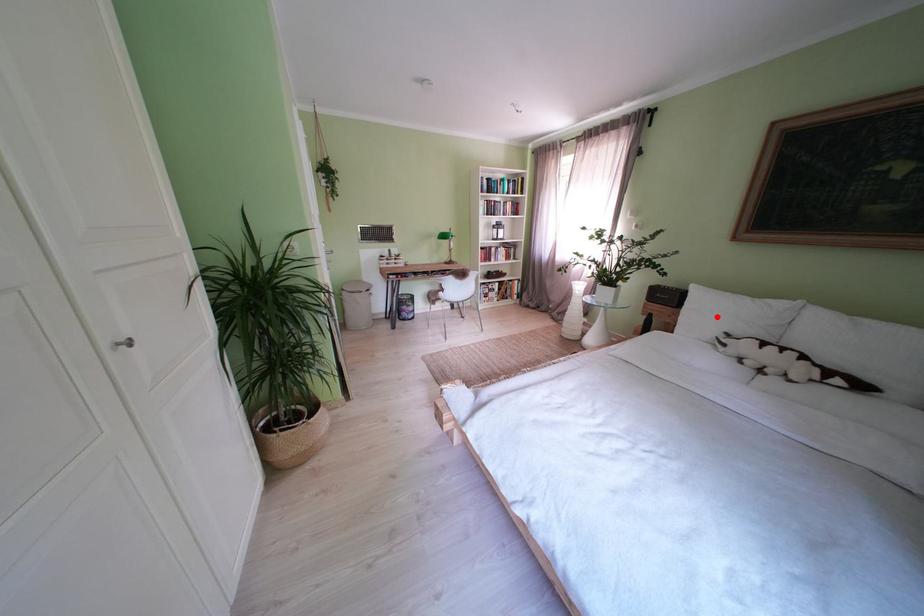
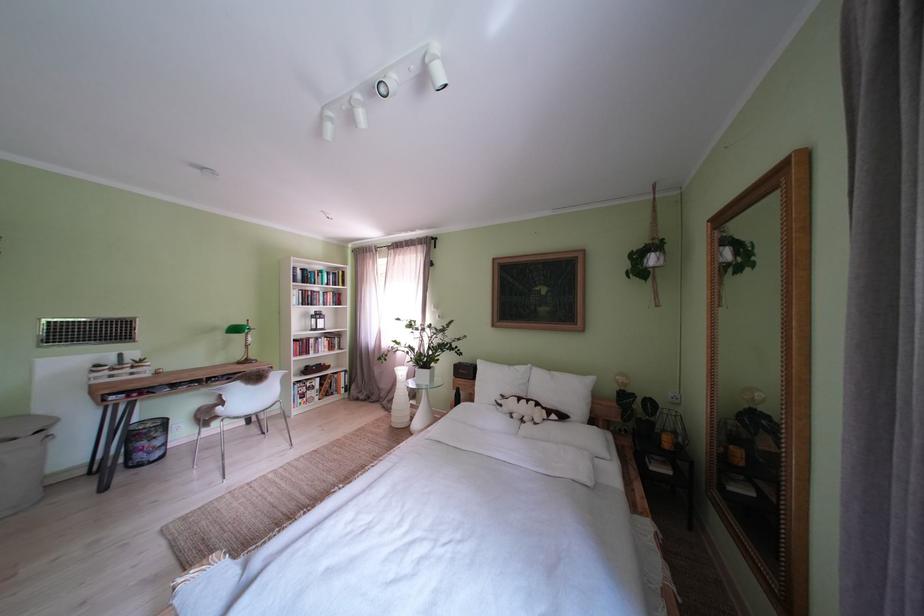
Where in the second image is the point corresponding to the highlighted location from the first image?

(500, 386)